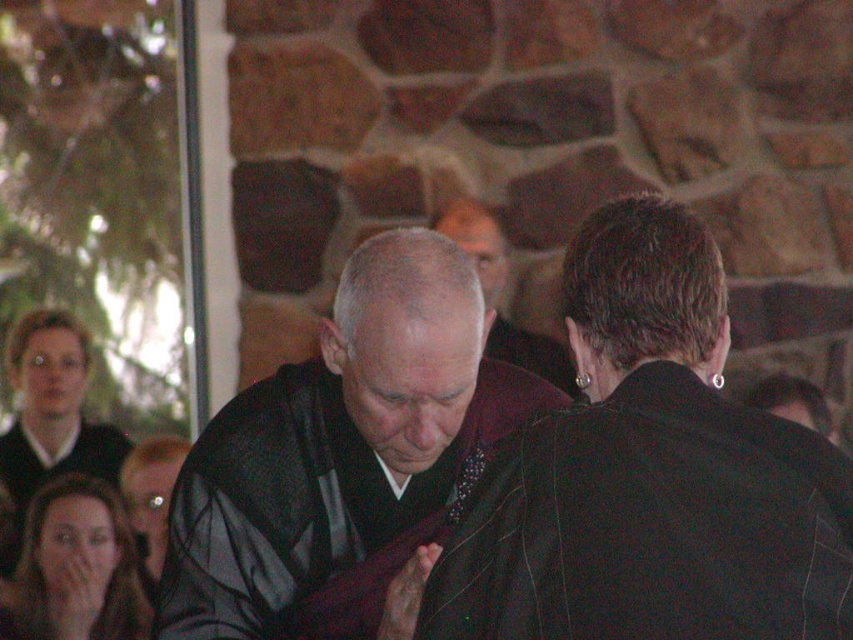
Does dark brown leather robe at center lie behind black silk robe at center?

That is False.

Is dark brown leather robe at center smaller than black silk robe at center?

Yes, dark brown leather robe at center is smaller than black silk robe at center.

Who is more distant from viewer, [692,376] or [439,380]?

The point [439,380] is behind.

The image size is (853, 640). I want to click on dark brown leather robe at center, so click(x=651, y=525).

Between point (595, 531) and point (523, 362), which one is positioned behind?

The point (523, 362) is behind.

You are a GUI agent. You are given a task and a screenshot of the screen. Output one action in this format:
    pyautogui.click(x=<x>, y=<y>)
    Task: Click on the dark brown leather robe at center
    The image size is (853, 640).
    Given the screenshot: What is the action you would take?
    pyautogui.click(x=651, y=525)

This screenshot has height=640, width=853. I want to click on dark brown leather robe at center, so click(x=651, y=525).

Locate an element on the screen. The height and width of the screenshot is (640, 853). dark brown leather robe at center is located at coordinates (651, 525).

Does black silk robe at center have a lesser width compared to dark gray robe at center?

Incorrect, black silk robe at center's width is not less than dark gray robe at center's.

Describe the element at coordinates (339, 442) in the screenshot. I see `black silk robe at center` at that location.

Identify the location of black silk robe at center. (339, 442).